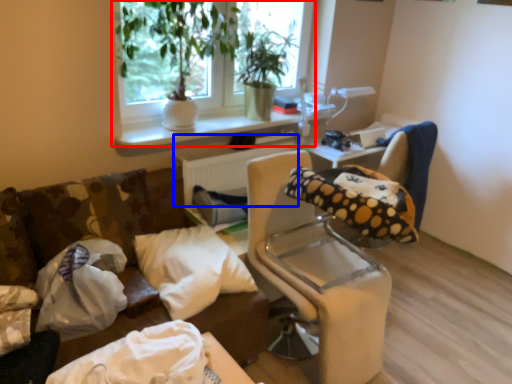
Question: Which object appears farthest to the camera in this image, window (highlighted by a red box) or radiator (highlighted by a blue box)?

Choices:
 (A) window
 (B) radiator

Answer: (B)